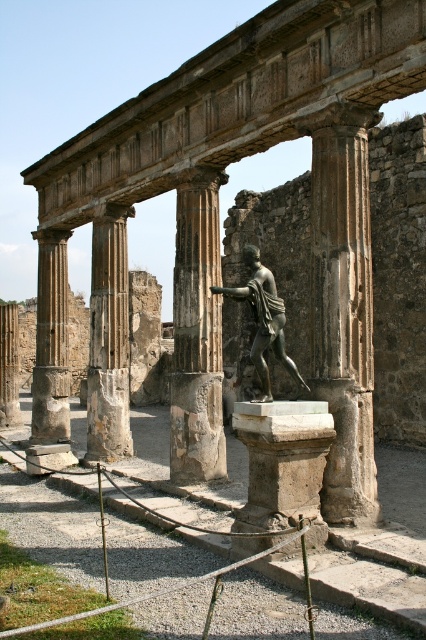
Can you confirm if marble column at center is thinner than smooth stone column at left?

No, marble column at center is not thinner than smooth stone column at left.

Does marble column at center have a larger size compared to smooth stone column at left?

Yes.

Which is behind, point (97, 259) or point (63, 317)?

The point (63, 317) is behind.

This screenshot has width=426, height=640. In order to click on marble column at center in this screenshot , I will do `click(109, 339)`.

Locate an element on the screen. This screenshot has width=426, height=640. stone column at center is located at coordinates (196, 333).

Between stone column at center and smooth stone column at left, which one has more height?

stone column at center is taller.

Where is `stone column at center`? stone column at center is located at coordinates (196, 333).

Consider the image. Which is below, brown stone column at center or smooth stone column at left?

Positioned lower is smooth stone column at left.

Between point (336, 177) and point (54, 420), which one is positioned behind?

Point (54, 420)

The image size is (426, 640). In order to click on brown stone column at center in this screenshot , I will do `click(342, 307)`.